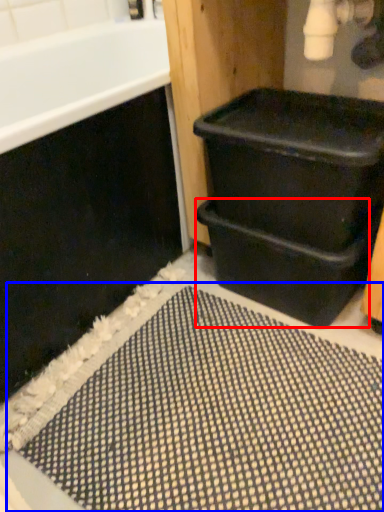
Question: Which object is closer to the camera taking this photo, drawer (highlighted by a red box) or bath mat (highlighted by a blue box)?

Choices:
 (A) drawer
 (B) bath mat

Answer: (B)